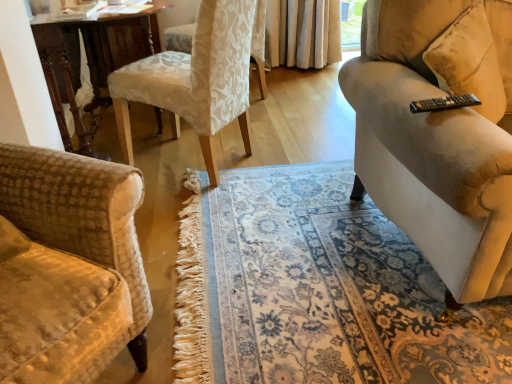
Question: Is white damask fabric chair at upper center, the 2th chair from the front, not within white fabric chair at center, the 1th chair from the front?

Choices:
 (A) yes
 (B) no

Answer: (A)

Question: Does white damask fabric chair at upper center, the 2th chair from the front, have a lesser width compared to white fabric chair at center, the 1th chair from the front?

Choices:
 (A) yes
 (B) no

Answer: (B)

Question: From a real-world perspective, is white damask fabric chair at upper center, the 2th chair from the front, on white fabric chair at center, the 1th chair from the front?

Choices:
 (A) yes
 (B) no

Answer: (B)

Question: Is white damask fabric chair at upper center, the 2th chair from the front, closer to the viewer compared to white fabric chair at center, the 1th chair from the front?

Choices:
 (A) no
 (B) yes

Answer: (A)

Question: Does white damask fabric chair at upper center, the 2th chair from the front, have a greater height compared to white fabric chair at center, the 1th chair from the front?

Choices:
 (A) yes
 (B) no

Answer: (B)

Question: Can you confirm if white damask fabric chair at upper center, arranged as the first chair when viewed from the back, is bigger than white fabric chair at center, the 1th chair from the front?

Choices:
 (A) yes
 (B) no

Answer: (B)

Question: Does white fabric chair at center, the 1th chair from the front, have a greater width compared to white damask fabric chair at upper center, arranged as the first chair when viewed from the back?

Choices:
 (A) yes
 (B) no

Answer: (B)

Question: Considering the relative sizes of white fabric chair at center, which is the 2th chair from back to front, and white damask fabric chair at upper center, arranged as the first chair when viewed from the back, in the image provided, is white fabric chair at center, which is the 2th chair from back to front, taller than white damask fabric chair at upper center, arranged as the first chair when viewed from the back,?

Choices:
 (A) no
 (B) yes

Answer: (B)

Question: From the image's perspective, does white fabric chair at center, the 1th chair from the front, appear lower than white damask fabric chair at upper center, the 2th chair from the front?

Choices:
 (A) no
 (B) yes

Answer: (B)

Question: Is white damask fabric chair at upper center, arranged as the first chair when viewed from the back, a part of white fabric chair at center, the 1th chair from the front?

Choices:
 (A) yes
 (B) no

Answer: (B)

Question: From the image's perspective, does white fabric chair at center, the 1th chair from the front, appear higher than white damask fabric chair at upper center, arranged as the first chair when viewed from the back?

Choices:
 (A) no
 (B) yes

Answer: (A)

Question: Can you confirm if white fabric chair at center, the 1th chair from the front, is smaller than white damask fabric chair at upper center, the 2th chair from the front?

Choices:
 (A) no
 (B) yes

Answer: (A)

Question: Is wooden table at center surrounding white fabric chair at center, the 1th chair from the front?

Choices:
 (A) yes
 (B) no

Answer: (B)